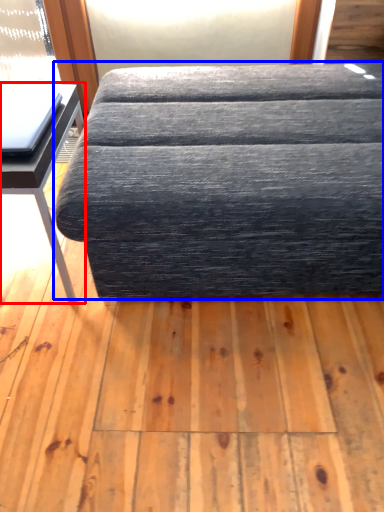
Question: Among these objects, which one is nearest to the camera, table (highlighted by a red box) or studio couch (highlighted by a blue box)?

Choices:
 (A) table
 (B) studio couch

Answer: (B)